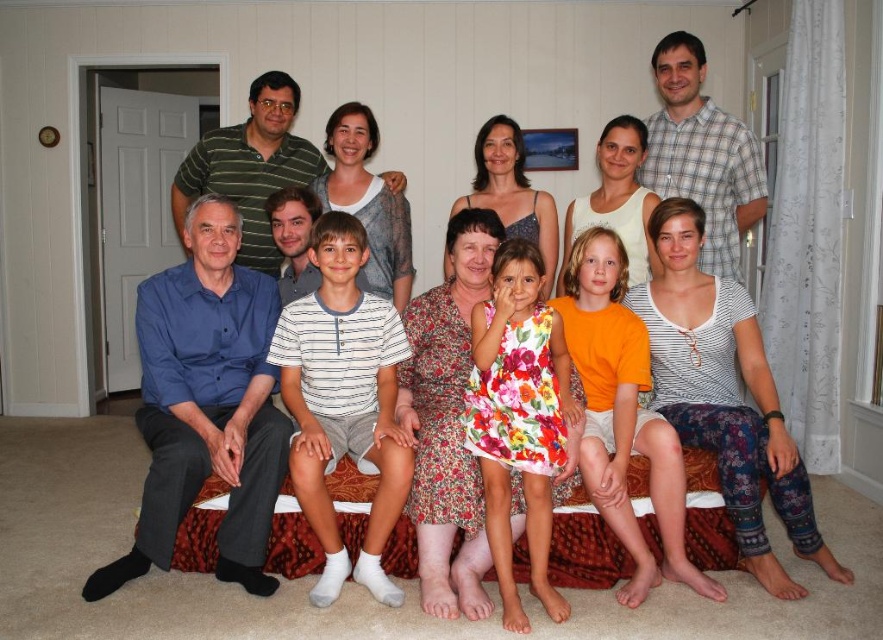
How much distance is there between white striped shirt at center and floral cotton dress at center?

The distance of white striped shirt at center from floral cotton dress at center is 18.74 inches.

Which is above, white striped shirt at center or floral cotton dress at center?

white striped shirt at center is above.

What do you see at coordinates (344, 401) in the screenshot? I see `white striped shirt at center` at bounding box center [344, 401].

Where is `white striped shirt at center`? white striped shirt at center is located at coordinates (344, 401).